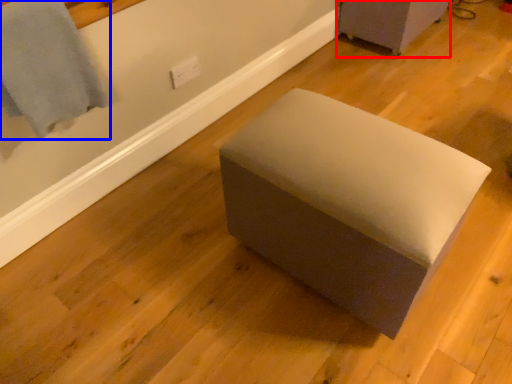
Question: Among these objects, which one is nearest to the camera, furniture (highlighted by a red box) or bath towel (highlighted by a blue box)?

Choices:
 (A) furniture
 (B) bath towel

Answer: (B)